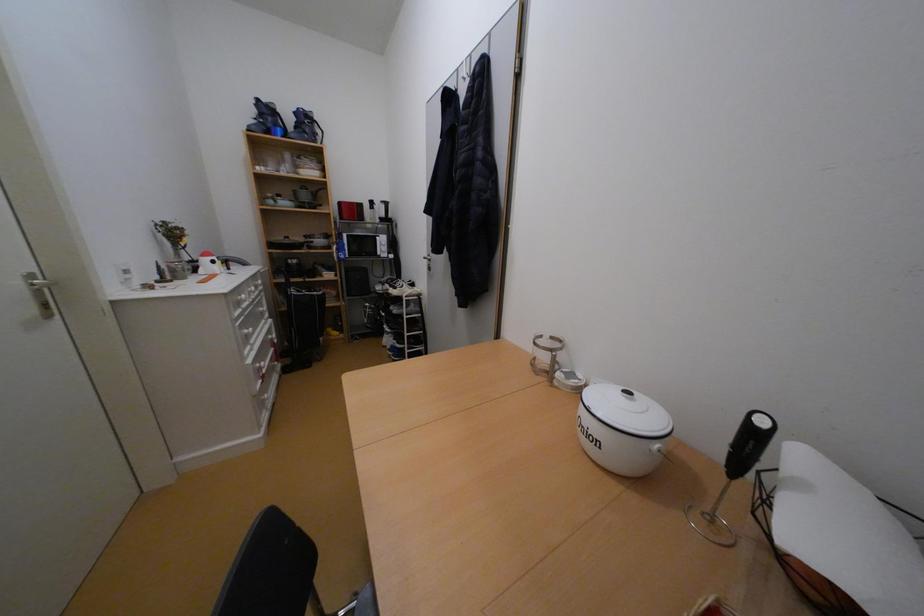
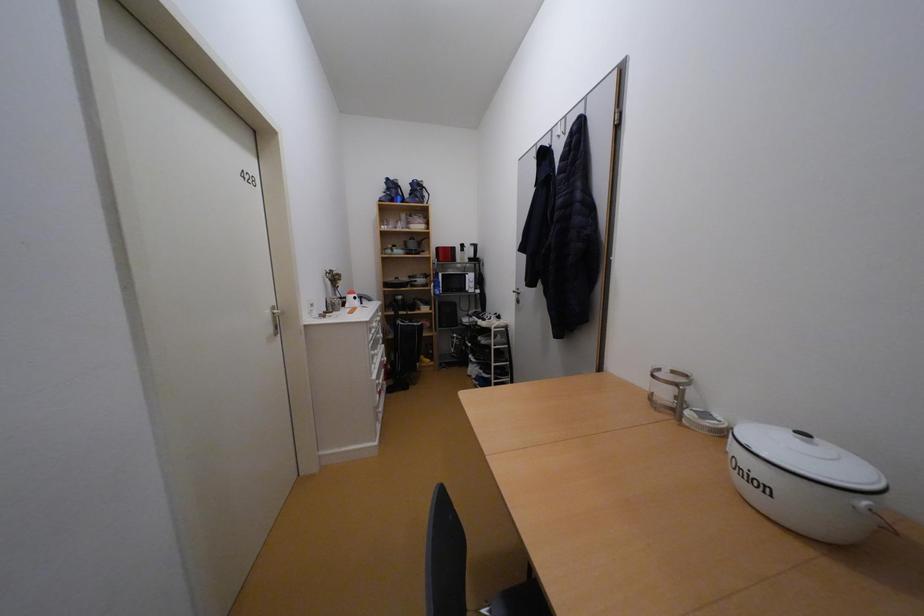
Looking at this image, the images are taken continuously from a first-person perspective. In which direction are you moving?

The movement direction of the cameraman is left, backward.